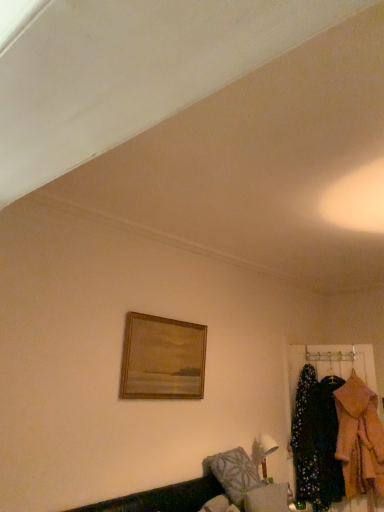
Question: Is floral fabric coat at right in front of or behind fluffy gray pillow at lower center in the image?

Choices:
 (A) behind
 (B) front

Answer: (A)

Question: Considering the relative positions of floral fabric coat at right and fluffy gray pillow at lower center in the image provided, is floral fabric coat at right to the left or to the right of fluffy gray pillow at lower center?

Choices:
 (A) right
 (B) left

Answer: (A)

Question: Estimate the real-world distances between objects in this image. Which object is closer to the fluffy gray pillow at lower center?

Choices:
 (A) fluffy pink coat at right
 (B) wooden framed painting at upper center
 (C) floral fabric coat at right
 (D) velvet green couch at lower right

Answer: (D)

Question: Which object is positioned closest to the fluffy gray pillow at lower center?

Choices:
 (A) floral fabric coat at right
 (B) velvet green couch at lower right
 (C) fluffy pink coat at right
 (D) wooden framed painting at upper center

Answer: (B)